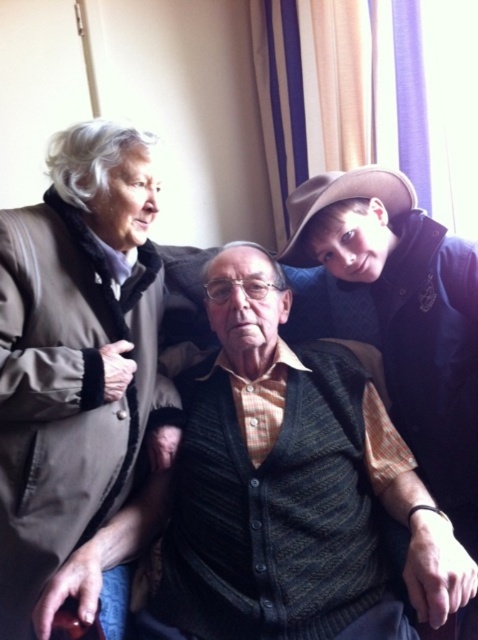
Is matte brown coat at left further to camera compared to knitted dark green vest at center?

That is True.

Between point (76, 314) and point (315, 563), which one is positioned in front?

Point (315, 563)

Is point (75, 572) farther from viewer compared to point (376, 484)?

That is False.

What are the coordinates of `matte brown coat at left` in the screenshot? It's located at (79, 378).